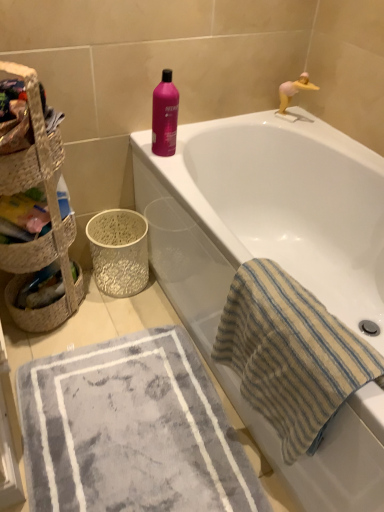
Locate an element on the screen. free space to the right of woven straw basket at left, arranged as the 1th basket when ordered from the bottom is located at coordinates point(117,320).